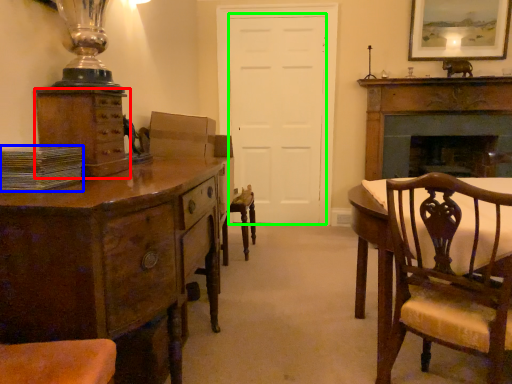
Question: Which object is positioned closest to cabinetry (highlighted by a red box)? Select from book (highlighted by a blue box) and door (highlighted by a green box).

Choices:
 (A) book
 (B) door

Answer: (A)